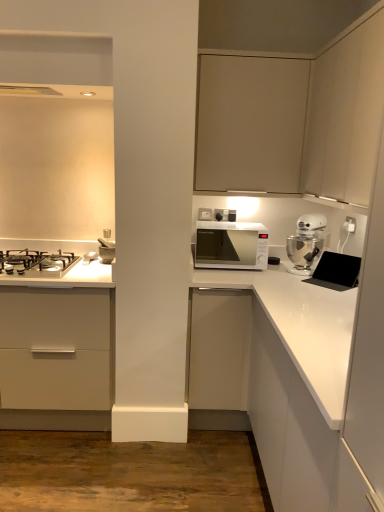
What is the approximate width of matte beige cabinet at upper center, the fifth cabinetry positioned from the bottom?

It is 32.32 centimeters.

The height and width of the screenshot is (512, 384). Describe the element at coordinates (301, 327) in the screenshot. I see `white glossy countertop at center, arranged as the 1th countertop when viewed from the right` at that location.

Describe the element at coordinates (293, 117) in the screenshot. I see `matte beige cabinet at upper center, the third cabinetry from the top` at that location.

Consider the image. Measure the distance between point (329, 113) and camera.

Point (329, 113) and camera are 2.03 meters apart.

Image resolution: width=384 pixels, height=512 pixels. What do you see at coordinates (231, 245) in the screenshot? I see `white glossy microwave at center` at bounding box center [231, 245].

You are a GUI agent. You are given a task and a screenshot of the screen. Output one action in this format:
    pyautogui.click(x=<x>, y=<y>)
    Task: Click on the matte beige cabinet at upper center, the 1th cabinetry from the top
    This screenshot has height=512, width=384.
    Given the screenshot: What is the action you would take?
    pyautogui.click(x=250, y=123)

Would you consider matte beige cabinet at upper right, which appears as the fourth cabinetry when ordered from the bottom, to be distant from matte beige cabinet at upper center, the 1th cabinetry from the top?

No, matte beige cabinet at upper right, which appears as the fourth cabinetry when ordered from the bottom, is not far from matte beige cabinet at upper center, the 1th cabinetry from the top.

Is matte beige cabinet at upper right, which appears as the 2th cabinetry when viewed from the top, smaller than matte beige cabinet at upper center, the fifth cabinetry positioned from the bottom?

No, matte beige cabinet at upper right, which appears as the 2th cabinetry when viewed from the top, is not smaller than matte beige cabinet at upper center, the fifth cabinetry positioned from the bottom.

Is matte beige cabinet at upper right, which appears as the fourth cabinetry when ordered from the bottom, turned away from matte beige cabinet at upper center, the fifth cabinetry positioned from the bottom?

No, matte beige cabinet at upper center, the fifth cabinetry positioned from the bottom, is not at the back of matte beige cabinet at upper right, which appears as the fourth cabinetry when ordered from the bottom.

Which object is more forward, matte beige cabinet at upper right, which appears as the 2th cabinetry when viewed from the top, or matte beige cabinet at upper center, the fifth cabinetry positioned from the bottom?

matte beige cabinet at upper right, which appears as the 2th cabinetry when viewed from the top, is more forward.

Based on the photo, is white glossy stand mixer at upper right oriented away from white glossy countertop at lower left, which is counted as the second countertop, starting from the right?

No.

Relative to white glossy countertop at lower left, the second countertop when ordered from bottom to top, is white glossy stand mixer at upper right in front or behind?

Visually, white glossy stand mixer at upper right is located behind white glossy countertop at lower left, the second countertop when ordered from bottom to top.

Find the location of a particular element. the 1st countertop located beneath the white glossy stand mixer at upper right (from a real-world perspective) is located at coordinates (63, 276).

Does white glossy stand mixer at upper right have a lesser height compared to white glossy countertop at lower left, which is counted as the second countertop, starting from the right?

Incorrect, the height of white glossy stand mixer at upper right does not fall short of that of white glossy countertop at lower left, which is counted as the second countertop, starting from the right.

From the image's perspective, who appears lower, matte white exhaust hood at upper left or white matte cabinet at center, the 2th cabinetry in the bottom-to-top sequence?

From the image's view, white matte cabinet at center, the 2th cabinetry in the bottom-to-top sequence, is below.

Is matte white exhaust hood at upper left facing towards white matte cabinet at center, which ranks as the fourth cabinetry in top-to-bottom order?

No, matte white exhaust hood at upper left is not oriented towards white matte cabinet at center, which ranks as the fourth cabinetry in top-to-bottom order.

Considering the sizes of objects matte white exhaust hood at upper left and white matte cabinet at center, which ranks as the fourth cabinetry in top-to-bottom order, in the image provided, who is thinner, matte white exhaust hood at upper left or white matte cabinet at center, which ranks as the fourth cabinetry in top-to-bottom order,?

Thinner between the two is matte white exhaust hood at upper left.

Is white plastic electric outlet at upper right taller or shorter than white glossy microwave at center?

Clearly, white plastic electric outlet at upper right is shorter compared to white glossy microwave at center.

Are white plastic electric outlet at upper right and white glossy microwave at center located far from each other?

That's not correct — white plastic electric outlet at upper right is a little close to white glossy microwave at center.

Does point (351, 217) come behind point (266, 268)?

No, it is in front of (266, 268).

From the picture: Between white plastic electric outlet at upper right and white glossy microwave at center, which one is positioned in front?

Positioned in front is white glossy microwave at center.

Which of these two, white matte cabinet at center, which ranks as the fourth cabinetry in top-to-bottom order, or matte white exhaust hood at upper left, is wider?

With larger width is white matte cabinet at center, which ranks as the fourth cabinetry in top-to-bottom order.

Is white matte cabinet at center, the 2th cabinetry in the bottom-to-top sequence, turned away from matte white exhaust hood at upper left?

No.

Is white matte cabinet at center, the 2th cabinetry in the bottom-to-top sequence, further to the viewer compared to matte white exhaust hood at upper left?

Yes.

From the image's perspective, is white matte cabinet at center, the 2th cabinetry in the bottom-to-top sequence, over matte beige cabinet at upper right, which appears as the 2th cabinetry when viewed from the top?

No, from the image's perspective, white matte cabinet at center, the 2th cabinetry in the bottom-to-top sequence, is not over matte beige cabinet at upper right, which appears as the 2th cabinetry when viewed from the top.

This screenshot has height=512, width=384. I want to click on the 3rd cabinetry located above the white matte cabinet at center, the 2th cabinetry in the bottom-to-top sequence (from a real-world perspective), so click(346, 115).

In the scene shown: Is white matte cabinet at center, the 2th cabinetry in the bottom-to-top sequence, taller than matte beige cabinet at upper right, which appears as the 2th cabinetry when viewed from the top?

Indeed, white matte cabinet at center, the 2th cabinetry in the bottom-to-top sequence, has a greater height compared to matte beige cabinet at upper right, which appears as the 2th cabinetry when viewed from the top.

In the scene shown: From the image's perspective, which is below, white glossy microwave at center or matte beige cabinet at upper center, the fifth cabinetry positioned from the bottom?

From the image's view, white glossy microwave at center is below.

Consider the image. Are white glossy microwave at center and matte beige cabinet at upper center, the fifth cabinetry positioned from the bottom, located far from each other?

They are positioned close to each other.

Do you think white glossy microwave at center is within matte beige cabinet at upper center, the fifth cabinetry positioned from the bottom, or outside of it?

The correct answer is: outside.

How different are the orientations of white glossy microwave at center and matte beige cabinet at upper center, the 1th cabinetry from the top, in degrees?

0.0528 degrees separate the facing orientations of white glossy microwave at center and matte beige cabinet at upper center, the 1th cabinetry from the top.

There is a matte beige cabinet at upper center, the 1th cabinetry from the top. At what (x,y) coordinates should I click in order to perform the action: click on the 1st cabinetry below it (from the image's perspective). Please return your answer as a coordinate pair (x, y). The image size is (384, 512). Looking at the image, I should click on (346, 115).

Starting from the white glossy stand mixer at upper right, which countertop is the 2nd one to the left? Please provide its 2D coordinates.

[(63, 276)]

Which object lies nearer to the anchor point white glossy countertop at center, acting as the 1th countertop starting from the bottom, white matte cabinet at center, which ranks as the fourth cabinetry in top-to-bottom order, or matte beige cabinet at upper right, which appears as the 2th cabinetry when viewed from the top?

Among the two, white matte cabinet at center, which ranks as the fourth cabinetry in top-to-bottom order, is located nearer to white glossy countertop at center, acting as the 1th countertop starting from the bottom.

Estimate the real-world distances between objects in this image. Which object is further from matte beige cabinet at upper center, the 3th cabinetry from the bottom, white glossy stand mixer at upper right or white glossy countertop at center, arranged as the 1th countertop when viewed from the right?

white glossy countertop at center, arranged as the 1th countertop when viewed from the right, is further to matte beige cabinet at upper center, the 3th cabinetry from the bottom.

Which object lies further to the anchor point white glossy countertop at right, placed as the first cabinetry when sorted from bottom to top, white glossy stand mixer at upper right or matte beige cabinet at upper right, which appears as the 2th cabinetry when viewed from the top?

matte beige cabinet at upper right, which appears as the 2th cabinetry when viewed from the top, lies further to white glossy countertop at right, placed as the first cabinetry when sorted from bottom to top, than the other object.

Based on the photo, based on their spatial positions, is white glossy countertop at right, which is the 5th cabinetry from top to bottom, or white glossy countertop at lower left, which is the 1th countertop from top to bottom, closer to matte beige cabinet at upper right, which appears as the fourth cabinetry when ordered from the bottom?

white glossy countertop at right, which is the 5th cabinetry from top to bottom.

From the image, which object appears to be nearer to white glossy stand mixer at upper right, white matte cabinet at center, the 2th cabinetry in the bottom-to-top sequence, or matte beige cabinet at upper center, the 3th cabinetry from the bottom?

matte beige cabinet at upper center, the 3th cabinetry from the bottom.

Looking at the image, which one is located further to white glossy countertop at right, which is the 5th cabinetry from top to bottom, white glossy countertop at center, placed as the 2th countertop when sorted from left to right, or white matte cabinet at center, the 2th cabinetry in the bottom-to-top sequence?

The object further to white glossy countertop at right, which is the 5th cabinetry from top to bottom, is white matte cabinet at center, the 2th cabinetry in the bottom-to-top sequence.

Based on the photo, from the image, which object appears to be nearer to white glossy microwave at center, white plastic electric outlet at upper right or white glossy countertop at right, which is the 5th cabinetry from top to bottom?

Among the two, white plastic electric outlet at upper right is located nearer to white glossy microwave at center.

Which object lies further to the anchor point white plastic electric outlet at upper right, matte beige cabinet at upper right, which appears as the 2th cabinetry when viewed from the top, or white glossy countertop at right, placed as the first cabinetry when sorted from bottom to top?

white glossy countertop at right, placed as the first cabinetry when sorted from bottom to top.

Find the location of a particular element. This screenshot has width=384, height=512. countertop between matte white exhaust hood at upper left and white matte cabinet at center, which ranks as the fourth cabinetry in top-to-bottom order, in the up-down direction is located at coordinates (63, 276).

The height and width of the screenshot is (512, 384). Identify the location of countertop between matte white exhaust hood at upper left and matte beige cabinet at upper right, which appears as the fourth cabinetry when ordered from the bottom, in the horizontal direction. (301, 327).

The height and width of the screenshot is (512, 384). Find the location of `countertop between matte white exhaust hood at upper left and white plastic electric outlet at upper right in the horizontal direction`. countertop between matte white exhaust hood at upper left and white plastic electric outlet at upper right in the horizontal direction is located at coordinates (301, 327).

Where is `exhaust hood situated between white glossy countertop at lower left, which is counted as the second countertop, starting from the right, and white glossy countertop at center, arranged as the 1th countertop when viewed from the right, from left to right`? This screenshot has width=384, height=512. exhaust hood situated between white glossy countertop at lower left, which is counted as the second countertop, starting from the right, and white glossy countertop at center, arranged as the 1th countertop when viewed from the right, from left to right is located at coordinates (57, 91).